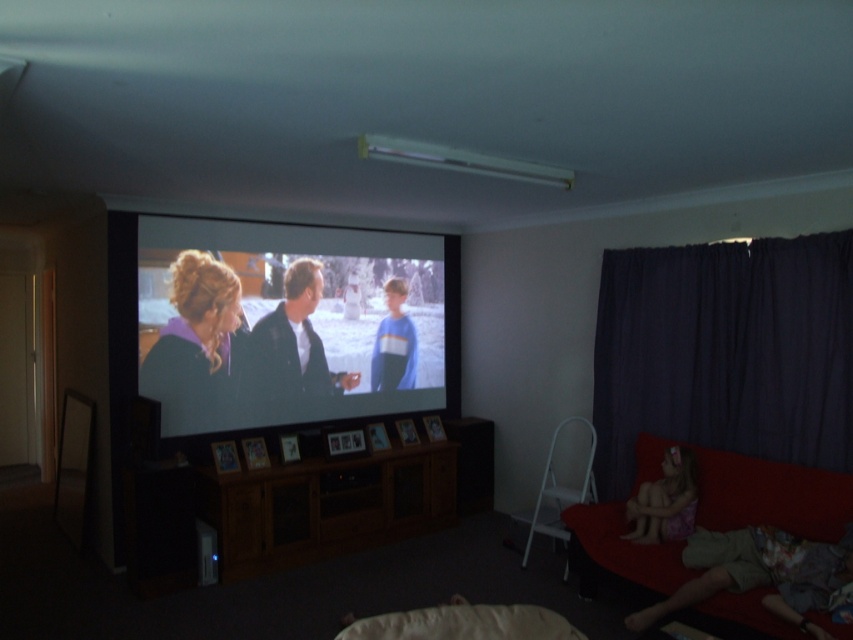
Question: Does dark purple fabric at right have a lesser width compared to matte black suit at center?

Choices:
 (A) yes
 (B) no

Answer: (B)

Question: Among these objects, which one is farthest from the camera?

Choices:
 (A) dark purple fabric at right
 (B) white fabric pillow at lower center

Answer: (A)

Question: Which object is the closest to the dark purple fabric at right?

Choices:
 (A) matte black suit at center
 (B) purple floral dress at lower right

Answer: (B)

Question: Considering the real-world distances, which object is closest to the matte black suit at center?

Choices:
 (A) red fabric couch at lower right
 (B) dark purple fabric at right
 (C) matte black screen at center
 (D) white fabric pillow at lower center

Answer: (C)

Question: Does matte black screen at center appear under red fabric couch at lower right?

Choices:
 (A) yes
 (B) no

Answer: (B)

Question: Observing the image, what is the correct spatial positioning of matte black screen at center in reference to purple floral dress at lower right?

Choices:
 (A) right
 (B) left

Answer: (B)